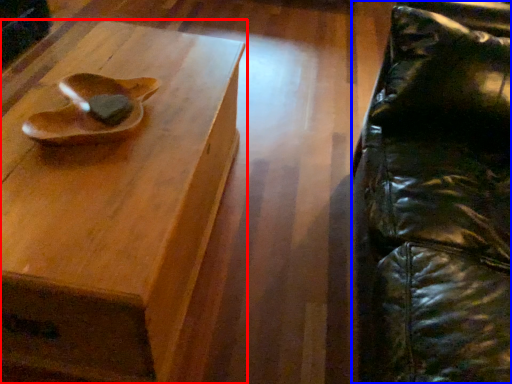
Question: Among these objects, which one is farthest to the camera, table (highlighted by a red box) or swivel chair (highlighted by a blue box)?

Choices:
 (A) table
 (B) swivel chair

Answer: (A)